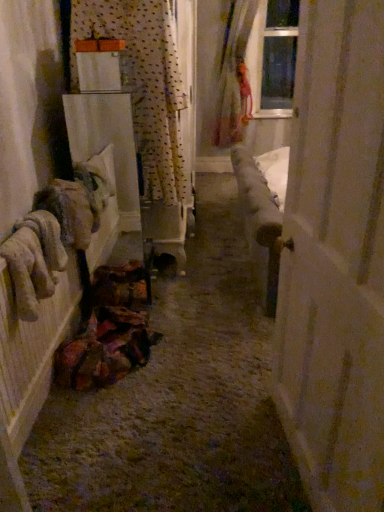
Question: Is white matte door at right surrounded by fuzzy beige gloves at left?

Choices:
 (A) no
 (B) yes

Answer: (A)

Question: Is fuzzy beige gloves at left placed right next to white matte door at right?

Choices:
 (A) no
 (B) yes

Answer: (A)

Question: Considering the relative sizes of fuzzy beige gloves at left and white matte door at right in the image provided, is fuzzy beige gloves at left thinner than white matte door at right?

Choices:
 (A) no
 (B) yes

Answer: (A)

Question: From a real-world perspective, is fuzzy beige gloves at left positioned under white matte door at right based on gravity?

Choices:
 (A) yes
 (B) no

Answer: (A)

Question: Can you confirm if fuzzy beige gloves at left is bigger than white matte door at right?

Choices:
 (A) no
 (B) yes

Answer: (A)

Question: Is fuzzy beige gloves at left taller or shorter than polka dot fabric curtain at upper left, which is the second curtain in right-to-left order?

Choices:
 (A) short
 (B) tall

Answer: (A)

Question: In the image, is fuzzy beige gloves at left positioned in front of or behind polka dot fabric curtain at upper left, placed as the 1th curtain when sorted from left to right?

Choices:
 (A) front
 (B) behind

Answer: (A)

Question: Which is correct: fuzzy beige gloves at left is inside polka dot fabric curtain at upper left, marked as the 2th curtain in a top-to-bottom arrangement, or outside of it?

Choices:
 (A) inside
 (B) outside

Answer: (B)

Question: In the image, is fuzzy beige gloves at left on the left side or the right side of polka dot fabric curtain at upper left, marked as the 2th curtain in a top-to-bottom arrangement?

Choices:
 (A) right
 (B) left

Answer: (B)

Question: From a real-world perspective, is white matte door at right physically located above or below polka dot fabric curtain at upper left, the first curtain positioned from the front?

Choices:
 (A) above
 (B) below

Answer: (B)

Question: Visually, is white matte door at right positioned to the left or to the right of polka dot fabric curtain at upper left, placed as the second curtain when sorted from back to front?

Choices:
 (A) left
 (B) right

Answer: (B)

Question: Is white matte door at right wider or thinner than polka dot fabric curtain at upper left, the first curtain positioned from the front?

Choices:
 (A) wide
 (B) thin

Answer: (B)

Question: In terms of size, does white matte door at right appear bigger or smaller than polka dot fabric curtain at upper left, the 1th curtain in the bottom-to-top sequence?

Choices:
 (A) big
 (B) small

Answer: (A)

Question: Is fuzzy beige gloves at left situated inside white matte door at right or outside?

Choices:
 (A) inside
 (B) outside

Answer: (B)

Question: Considering the relative positions of fuzzy beige gloves at left and white matte door at right in the image provided, is fuzzy beige gloves at left to the left or to the right of white matte door at right?

Choices:
 (A) right
 (B) left

Answer: (B)